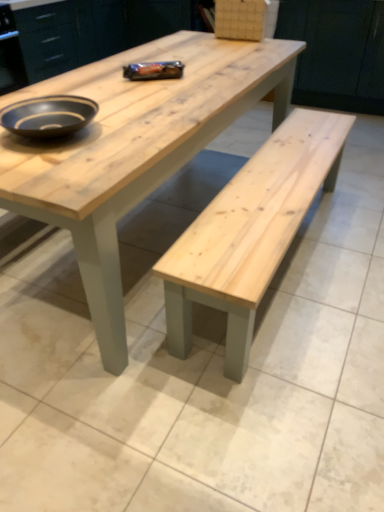
This screenshot has height=512, width=384. I want to click on free spot to the right of matte black bowl at upper left, so click(x=136, y=125).